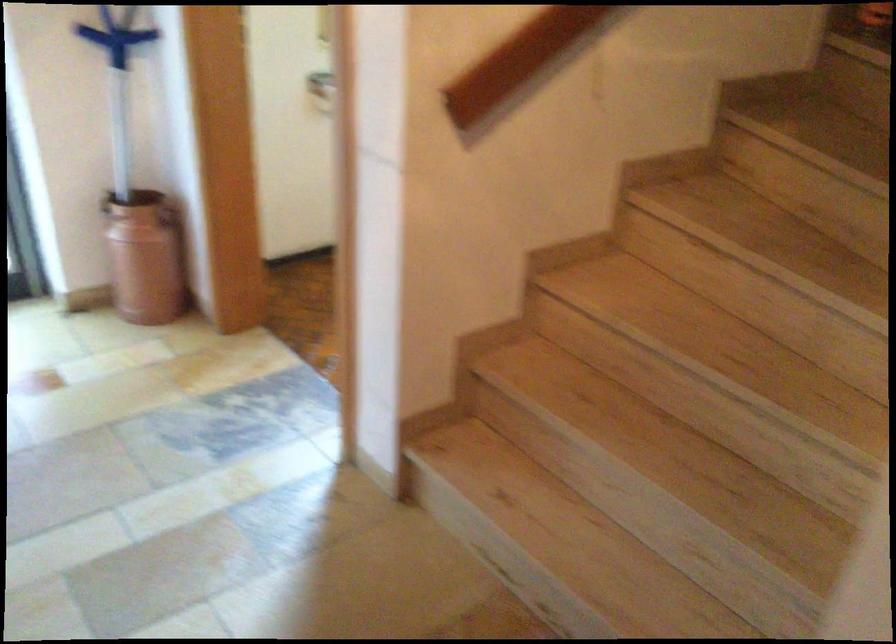
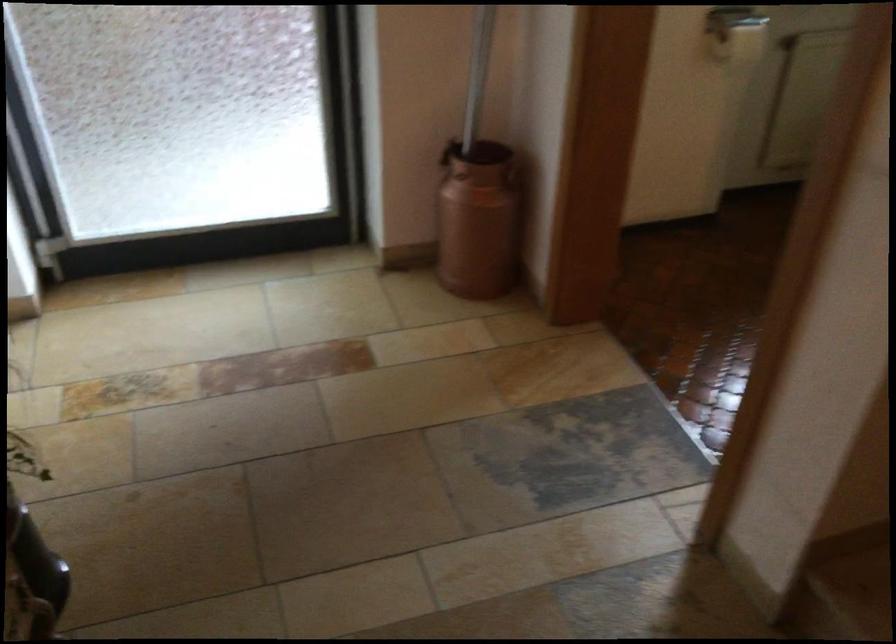
In the second image, find the point that corresponds to pixel 122 133 in the first image.

(478, 73)